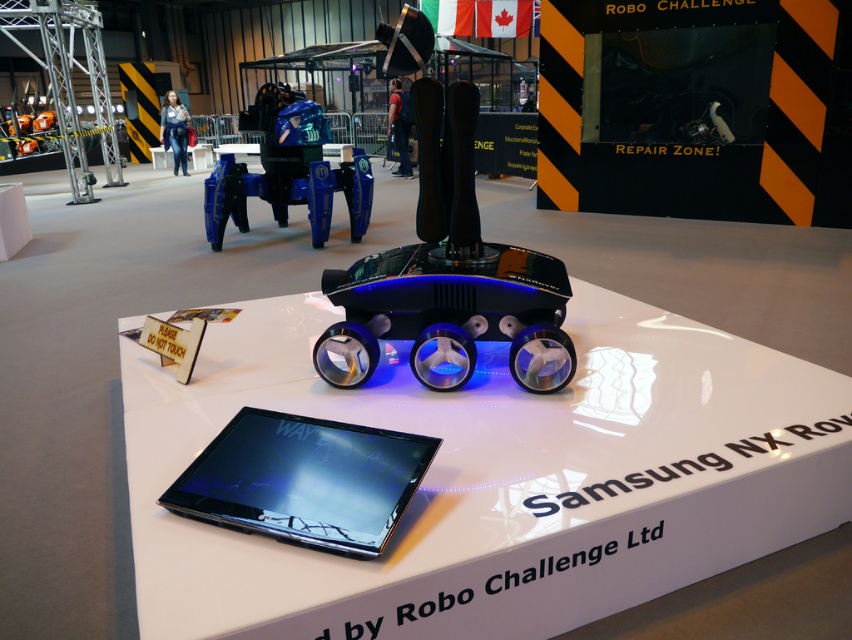
Question: Which point is farther to the camera?

Choices:
 (A) transparent plastic rover at center
 (B) matte black tablet at center
 (C) metallic blue robot at upper center

Answer: (C)

Question: Which is farther from the transparent plastic rover at center?

Choices:
 (A) metallic blue robot at upper center
 (B) matte black tablet at center

Answer: (A)

Question: Does transparent plastic rover at center come behind metallic blue robot at upper center?

Choices:
 (A) no
 (B) yes

Answer: (A)

Question: From the image, what is the correct spatial relationship of transparent plastic rover at center in relation to metallic blue robot at upper center?

Choices:
 (A) above
 (B) below

Answer: (B)

Question: Which point is farther to the camera?

Choices:
 (A) matte black tablet at center
 (B) metallic blue robot at upper center
 (C) transparent plastic rover at center

Answer: (B)

Question: Where is transparent plastic rover at center located in relation to metallic blue robot at upper center in the image?

Choices:
 (A) right
 (B) left

Answer: (A)